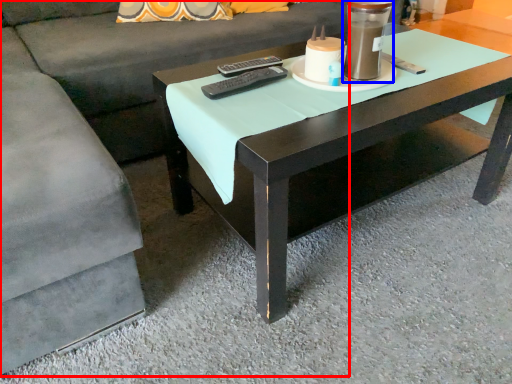
Question: Which of the following is the closest to the observer, couch (highlighted by a red box) or candle holder (highlighted by a blue box)?

Choices:
 (A) couch
 (B) candle holder

Answer: (A)